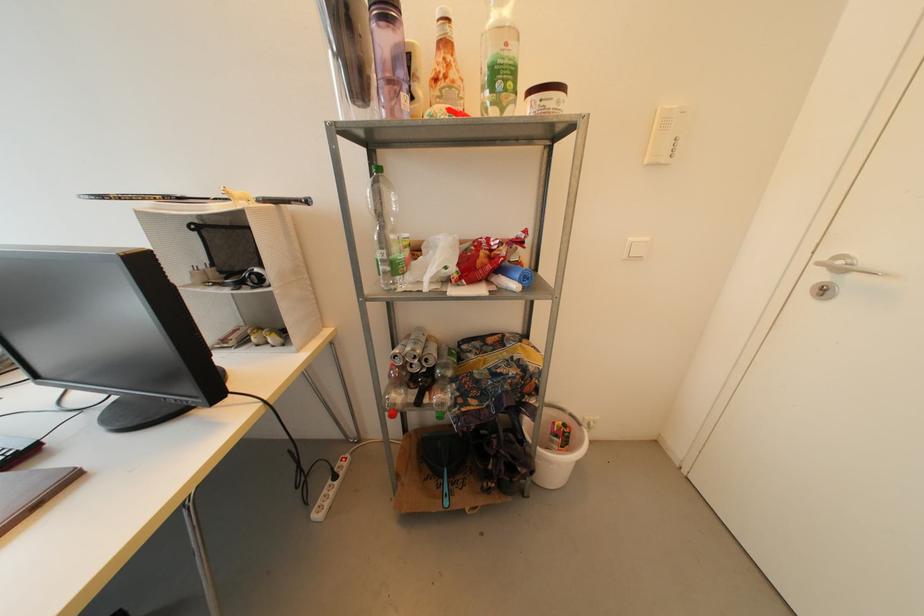
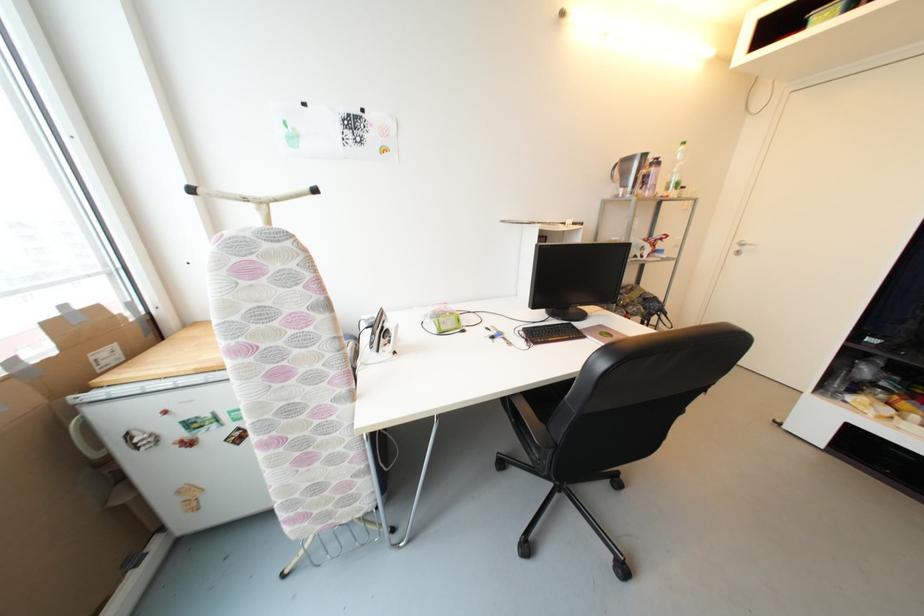
Find the pixel in the second image that matches the point at 823,278 in the first image.

(742, 249)